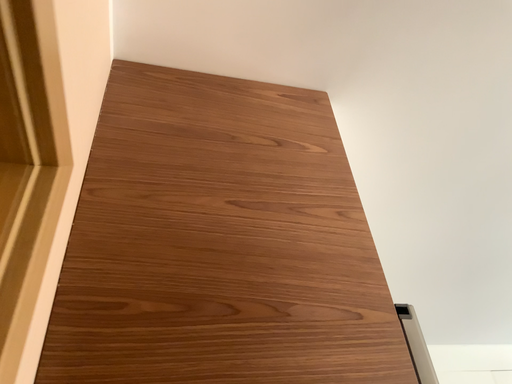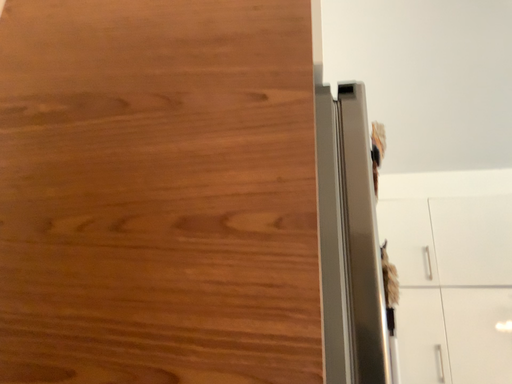
Question: How did the camera likely rotate when shooting the video?

Choices:
 (A) rotated right
 (B) rotated left

Answer: (B)